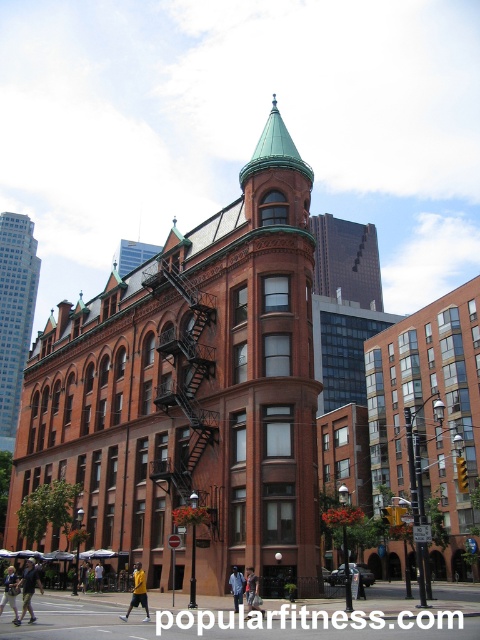
Question: Which object is the closest to the light blue denim jacket at lower left?

Choices:
 (A) dark blue jeans at center
 (B) dark blue jeans at lower left
 (C) light blue jeans at center
 (D) yellow fabric shirt at lower center

Answer: (B)

Question: Does black metal fire escape at center lie in front of light blue denim jacket at lower left?

Choices:
 (A) no
 (B) yes

Answer: (A)

Question: Which of the following is the closest to the observer?

Choices:
 (A) dark blue jeans at center
 (B) light blue jeans at center
 (C) dark blue jeans at lower left
 (D) light blue denim jacket at lower left

Answer: (C)

Question: Which object appears closest to the camera in this image?

Choices:
 (A) yellow fabric shirt at lower center
 (B) light blue jeans at center
 (C) light blue denim jacket at lower left
 (D) black metal fire escape at center

Answer: (C)

Question: Is black metal fire escape at center positioned in front of light blue denim jacket at lower left?

Choices:
 (A) no
 (B) yes

Answer: (A)

Question: Observing the image, what is the correct spatial positioning of black metal fire escape at center in reference to dark blue jeans at lower left?

Choices:
 (A) below
 (B) above

Answer: (B)